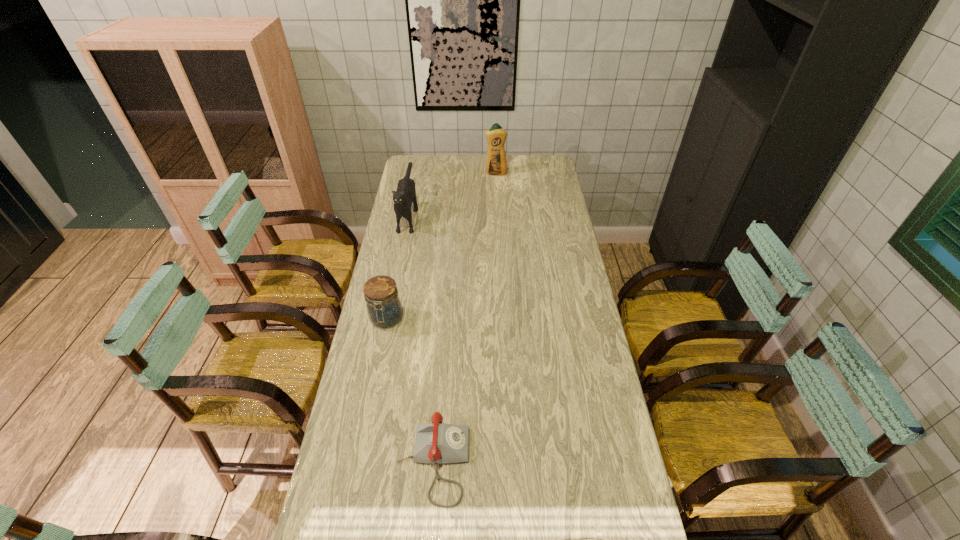
The width and height of the screenshot is (960, 540). In order to click on the rightmost object in this screenshot , I will do `click(496, 165)`.

Where is `the farthest object`? The height and width of the screenshot is (540, 960). the farthest object is located at coordinates [496, 165].

Find the location of a particular element. the third shortest object is located at coordinates (405, 195).

You are a GUI agent. You are given a task and a screenshot of the screen. Output one action in this format:
    pyautogui.click(x=<x>, y=<y>)
    Task: Click on the cat
    The width and height of the screenshot is (960, 540).
    Given the screenshot: What is the action you would take?
    [x=405, y=195]

I want to click on the second shortest object, so click(383, 304).

This screenshot has width=960, height=540. Find the location of `the second nearest object`. the second nearest object is located at coordinates (383, 304).

Locate an element on the screen. The image size is (960, 540). the second object from right to left is located at coordinates (436, 443).

I want to click on the shortest object, so click(x=436, y=443).

The height and width of the screenshot is (540, 960). In order to click on free point located 0.300m on the label of the detergent in this screenshot , I will do `click(497, 211)`.

Locate an element on the screen. The image size is (960, 540). free point located 0.180m on the front-facing side of the third shortest object is located at coordinates (397, 268).